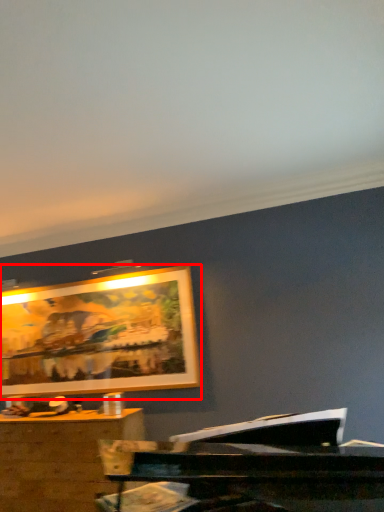
Question: From the image's perspective, what is the correct spatial relationship of picture frame (annotated by the red box) in relation to desk?

Choices:
 (A) below
 (B) above

Answer: (B)